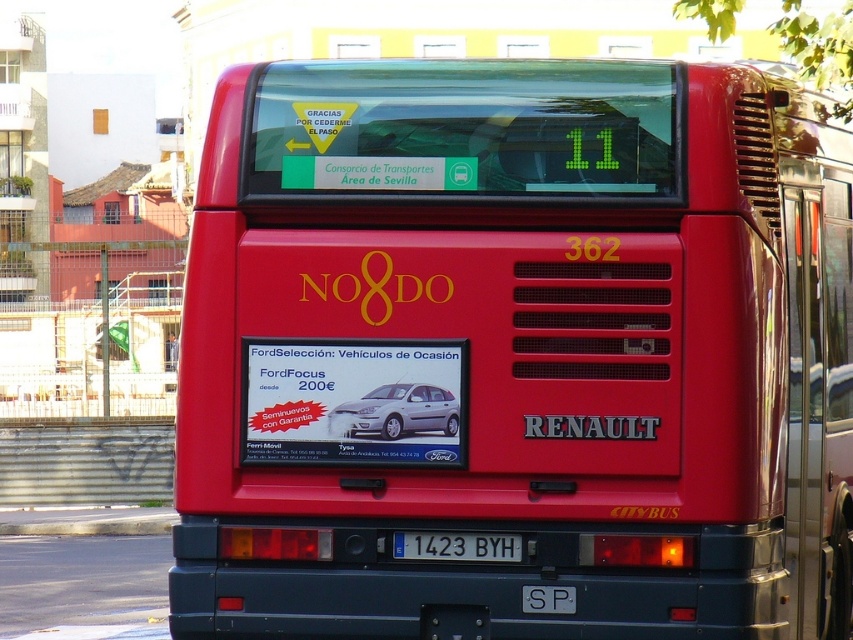
Is metallic silver car at center wider than satin silver metallic hatchback at center?

Yes.

Which is more to the left, metallic silver car at center or satin silver metallic hatchback at center?

From the viewer's perspective, metallic silver car at center appears more on the left side.

Does point (357, 420) come in front of point (368, 424)?

That is False.

The width and height of the screenshot is (853, 640). I want to click on metallic silver car at center, so click(x=352, y=403).

Consider the image. Between shiny red bus at center and white plastic license plate at center, which one is positioned lower?

white plastic license plate at center

Which is in front, point (349, 156) or point (444, 552)?

Point (444, 552) is in front.

Who is more distant from viewer, (817,198) or (488,540)?

The point (817,198) is more distant.

Locate an element on the screen. This screenshot has width=853, height=640. shiny red bus at center is located at coordinates tap(518, 352).

Can you confirm if shiny red bus at center is thinner than satin silver metallic hatchback at center?

Incorrect, shiny red bus at center's width is not less than satin silver metallic hatchback at center's.

Can you confirm if shiny red bus at center is positioned above satin silver metallic hatchback at center?

Indeed, shiny red bus at center is positioned over satin silver metallic hatchback at center.

Is point (219, 563) positioned after point (439, 419)?

Yes, it is.

Find the location of a particular element. Image resolution: width=853 pixels, height=640 pixels. shiny red bus at center is located at coordinates (518, 352).